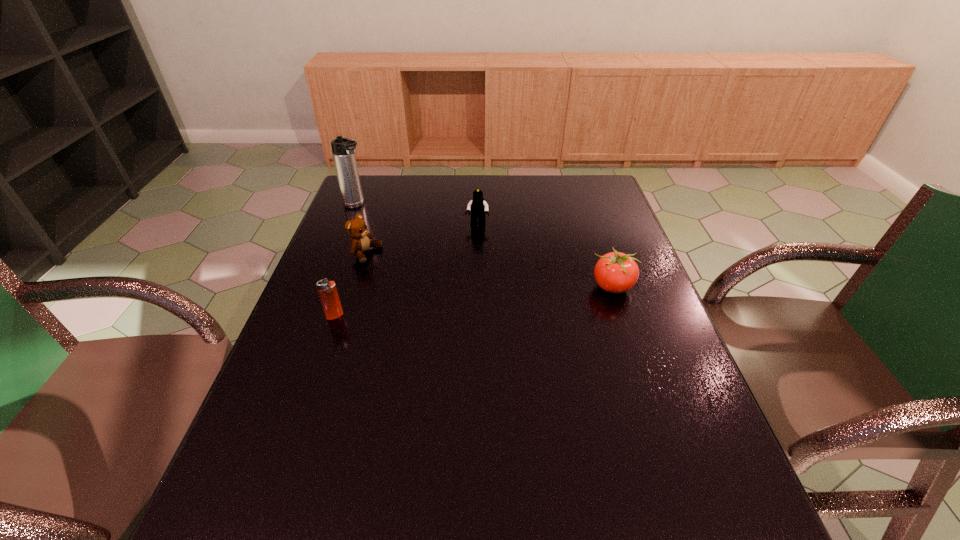
Image resolution: width=960 pixels, height=540 pixels. In order to click on the nearest object in this screenshot , I will do `click(327, 290)`.

At what (x,y) coordinates should I click in order to perform the action: click on tomato. Please return your answer as a coordinate pair (x, y). The image size is (960, 540). Looking at the image, I should click on (615, 272).

Where is `the second nearest object`? The image size is (960, 540). the second nearest object is located at coordinates (615, 272).

Find the location of `the third farthest object`. the third farthest object is located at coordinates (356, 228).

Image resolution: width=960 pixels, height=540 pixels. I want to click on the second object from right to left, so click(x=478, y=207).

What are the coordinates of `the fourth nearest object` in the screenshot? It's located at (478, 207).

The image size is (960, 540). What are the coordinates of `the farthest object` in the screenshot? It's located at (343, 149).

The height and width of the screenshot is (540, 960). I want to click on the tallest object, so click(343, 149).

The width and height of the screenshot is (960, 540). Identify the location of free location located on the right of the nearest object. (411, 316).

Locate an element on the screen. free space located on the back of the tomato is located at coordinates (588, 215).